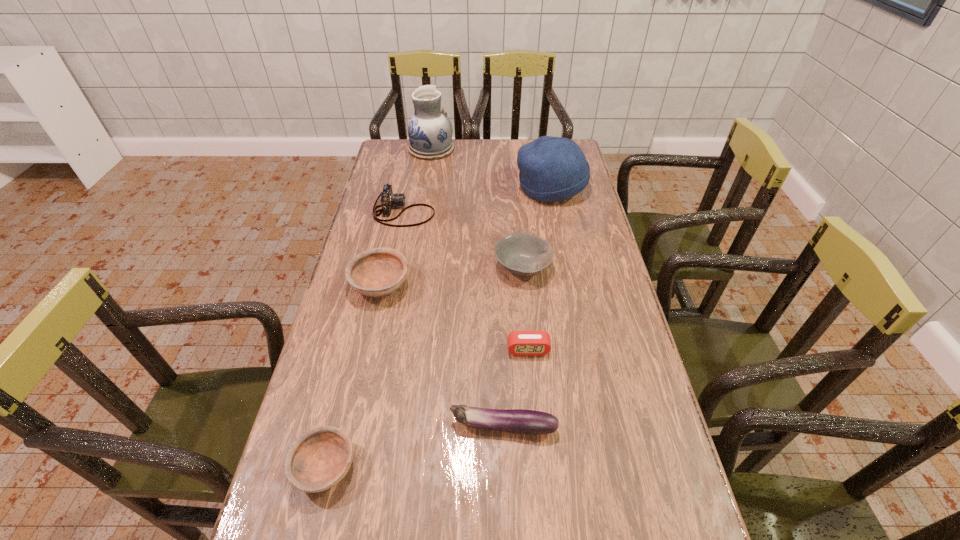
Locate an element on the screen. The image size is (960, 540). the nearest bowl is located at coordinates (319, 459).

Find the location of `vacant space located 0.150m on the front of the tallest object`. vacant space located 0.150m on the front of the tallest object is located at coordinates (426, 181).

Identify the location of vacant area located on the left of the skullcap. (493, 187).

Where is `vacant space located on the right of the farther brown bowl`? This screenshot has width=960, height=540. vacant space located on the right of the farther brown bowl is located at coordinates (500, 285).

Find the location of a particular element. The image size is (960, 540). vacant space located on the left of the rightmost bowl is located at coordinates (366, 267).

Where is `vacant region located on the front-facing side of the brown camera`? This screenshot has width=960, height=540. vacant region located on the front-facing side of the brown camera is located at coordinates (457, 212).

Locate an element on the screen. Image resolution: width=960 pixels, height=540 pixels. free location located 0.180m on the back of the eggplant is located at coordinates (500, 350).

Where is `vacant space situated on the front-facing side of the pink alarm clock`? Image resolution: width=960 pixels, height=540 pixels. vacant space situated on the front-facing side of the pink alarm clock is located at coordinates (537, 438).

The height and width of the screenshot is (540, 960). Find the location of `vacant space located 0.280m on the back of the nearer brown bowl`. vacant space located 0.280m on the back of the nearer brown bowl is located at coordinates (357, 337).

Identify the location of object at the far edge. (430, 131).